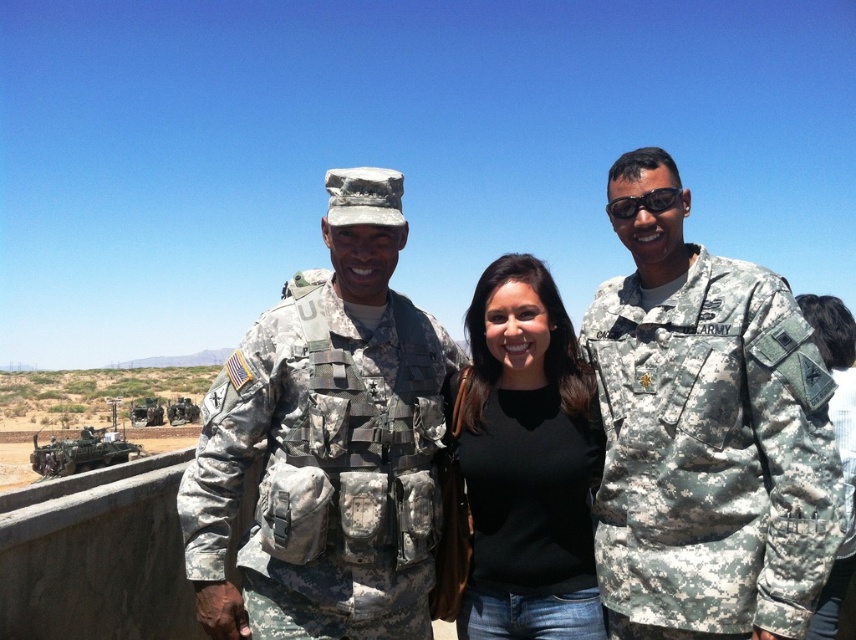
Based on the photo, you are a drone operator trying to identify the position of the camouflage fabric uniform at center in the image. What are the coordinates of this object?

The coordinates of the camouflage fabric uniform at center are at point (325, 445).

You are a drone operator trying to locate a specific soldier in the desert. You have coordinates from the mission report that the camouflage uniform at center is at point 0.677, 0.826. If you need to guide a drone to hover exactly above this soldier, what coordinates should you input into the drone system?

The camouflage uniform at center is located at coordinates (706, 433), so you should input these coordinates into the drone system to hover above it.